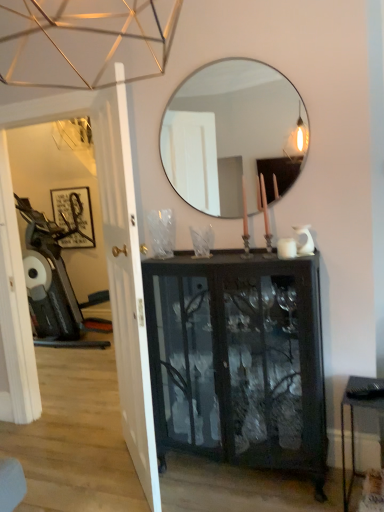
Question: Is metallic black table at lower right bigger than black glass cabinet at center?

Choices:
 (A) no
 (B) yes

Answer: (A)

Question: From a real-world perspective, is metallic black table at lower right located higher than black glass cabinet at center?

Choices:
 (A) no
 (B) yes

Answer: (A)

Question: Is metallic black table at lower right outside of black glass cabinet at center?

Choices:
 (A) yes
 (B) no

Answer: (A)

Question: Considering the relative positions of metallic black table at lower right and black glass cabinet at center in the image provided, is metallic black table at lower right behind black glass cabinet at center?

Choices:
 (A) no
 (B) yes

Answer: (A)

Question: Is metallic black table at lower right closer to camera compared to black glass cabinet at center?

Choices:
 (A) yes
 (B) no

Answer: (A)

Question: Is matte black picture frame at left in front of or behind metallic silver swivel chair at left in the image?

Choices:
 (A) behind
 (B) front

Answer: (A)

Question: Considering the relative positions of matte black picture frame at left and metallic silver swivel chair at left in the image provided, is matte black picture frame at left to the left or to the right of metallic silver swivel chair at left?

Choices:
 (A) left
 (B) right

Answer: (A)

Question: From the image's perspective, is matte black picture frame at left above or below metallic silver swivel chair at left?

Choices:
 (A) below
 (B) above

Answer: (B)

Question: Is matte black picture frame at left taller or shorter than metallic silver swivel chair at left?

Choices:
 (A) tall
 (B) short

Answer: (B)

Question: Does point (89, 233) appear closer or farther from the camera than point (195, 287)?

Choices:
 (A) farther
 (B) closer

Answer: (A)

Question: Do you think matte black picture frame at left is within black glass cabinet at center, or outside of it?

Choices:
 (A) outside
 (B) inside

Answer: (A)

Question: Looking at their shapes, would you say matte black picture frame at left is wider or thinner than black glass cabinet at center?

Choices:
 (A) thin
 (B) wide

Answer: (A)

Question: From a real-world perspective, relative to black glass cabinet at center, is matte black picture frame at left vertically above or below?

Choices:
 (A) above
 (B) below

Answer: (A)

Question: From a real-world perspective, is black glass cabinet at center positioned above or below clear glass mirror at upper center?

Choices:
 (A) above
 (B) below

Answer: (B)

Question: Considering the positions of black glass cabinet at center and clear glass mirror at upper center in the image, is black glass cabinet at center wider or thinner than clear glass mirror at upper center?

Choices:
 (A) thin
 (B) wide

Answer: (B)